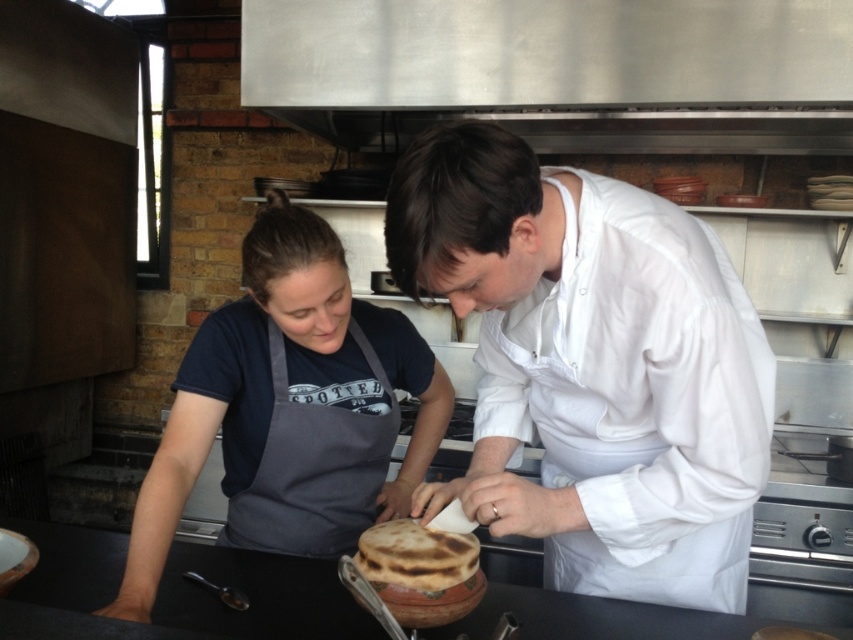
Question: Can you confirm if white matte chef coat at center is positioned below dark gray apron at center?

Choices:
 (A) no
 (B) yes

Answer: (A)

Question: Is white matte chef coat at center positioned behind brown matte flatbread at center?

Choices:
 (A) no
 (B) yes

Answer: (A)

Question: Which of these objects is positioned farthest from the dark gray apron at center?

Choices:
 (A) brown matte flatbread at center
 (B) white matte chef coat at center

Answer: (A)

Question: Which object appears closest to the camera in this image?

Choices:
 (A) white matte chef coat at center
 (B) dark gray apron at center
 (C) brown matte flatbread at center

Answer: (A)

Question: Can you confirm if white matte chef coat at center is positioned below brown matte flatbread at center?

Choices:
 (A) no
 (B) yes

Answer: (A)

Question: Estimate the real-world distances between objects in this image. Which object is closer to the brown matte flatbread at center?

Choices:
 (A) dark gray apron at center
 (B) white matte chef coat at center

Answer: (B)